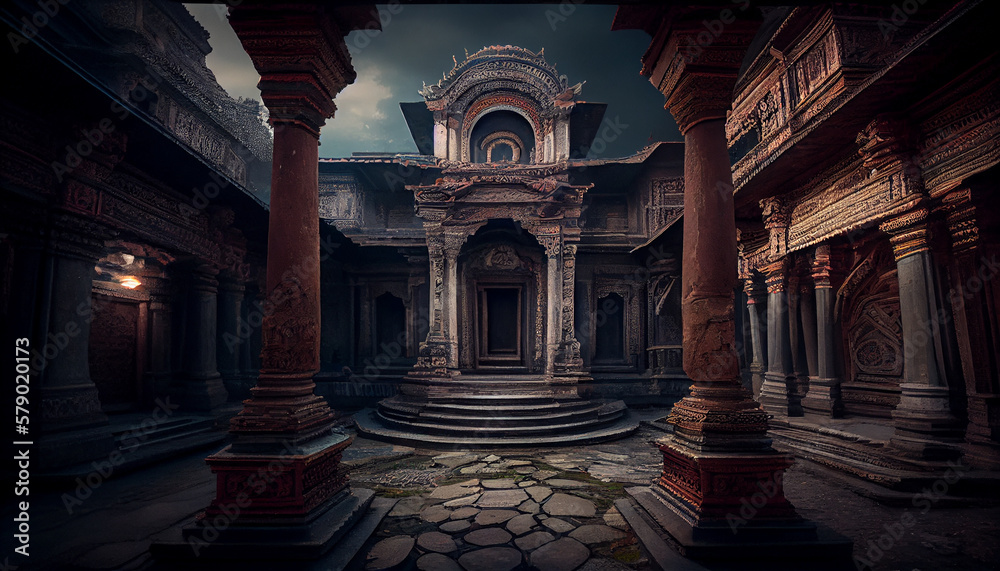
Identify the location of columns on right side. (756, 337), (773, 341), (830, 333), (914, 333).